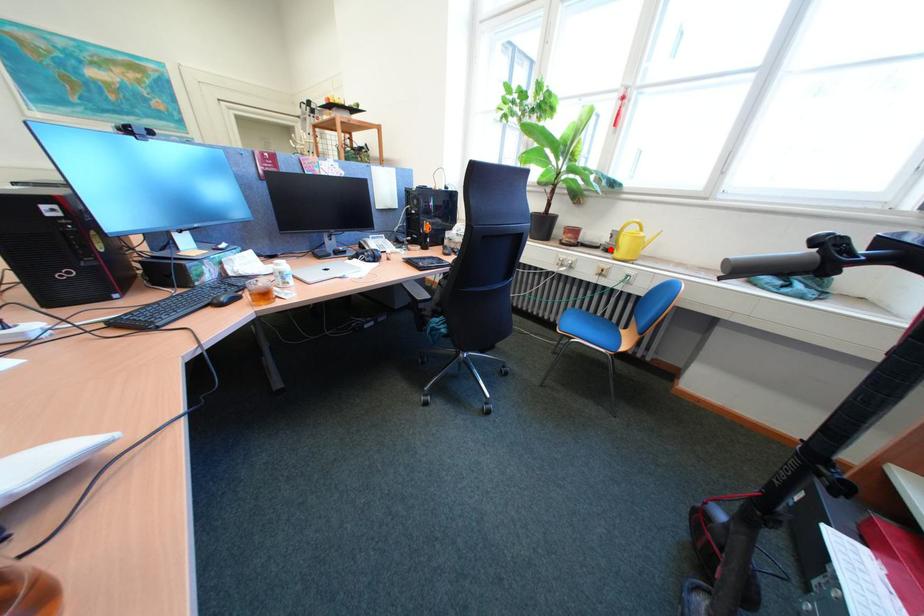
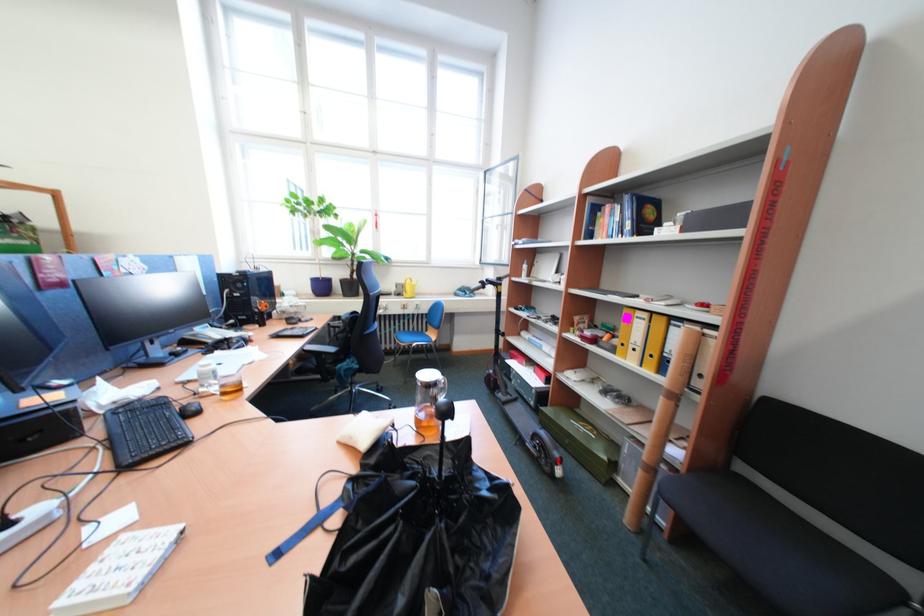
Where in the second image is the point corresponding to the highlighted location from the first image?

(403, 296)